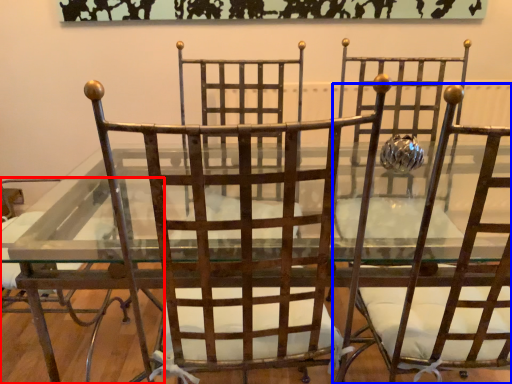
Question: Which point is closer to the camera, chair (highlighted by a red box) or chair (highlighted by a blue box)?

Choices:
 (A) chair
 (B) chair

Answer: (B)